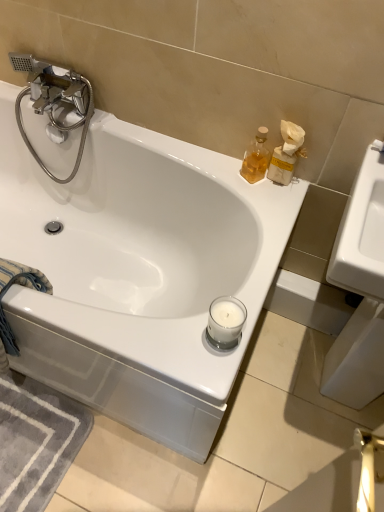
Where is `free location to the left of translucent glass soap dispenser at upper right`? This screenshot has width=384, height=512. free location to the left of translucent glass soap dispenser at upper right is located at coordinates (215, 164).